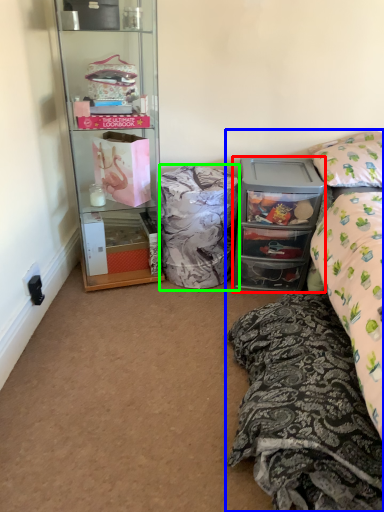
Question: Considering the real-world distances, which object is closest to cabinetry (highlighted by a red box)? bed (highlighted by a blue box) or material (highlighted by a green box).

Choices:
 (A) bed
 (B) material

Answer: (B)